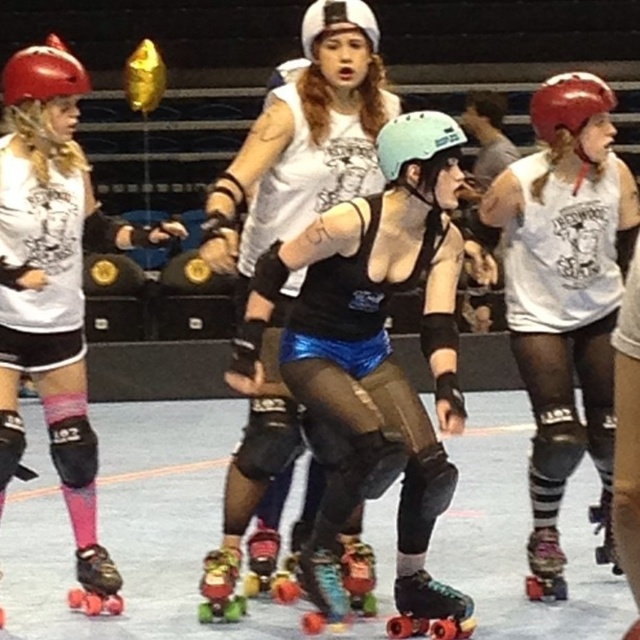
You are a referee observing the roller derby game. You notice two items in the image. One is the shiny blue shorts at center and the other is the pink matte knee pads at lower left. Which item is located to the right of the other?

The shiny blue shorts at center is positioned on the right side of pink matte knee pads at lower left.

You are a referee at the roller derby game. You need to ensure all skates comply with safety regulations. The rule states that the skate width must be at least 10 cm. Can you determine if both the shiny black roller skate at lower left and the shiny metallic roller skate at center meet the minimum width requirement based on their relative sizes?

The shiny black roller skate at lower left is wider than the shiny metallic roller skate at center. Since the minimum width requirement is 10 cm, if the shiny metallic roller skate at center meets the requirement, then the shiny black roller skate at lower left also does. However, without knowing the exact width of either, we cannot confirm compliance for both.